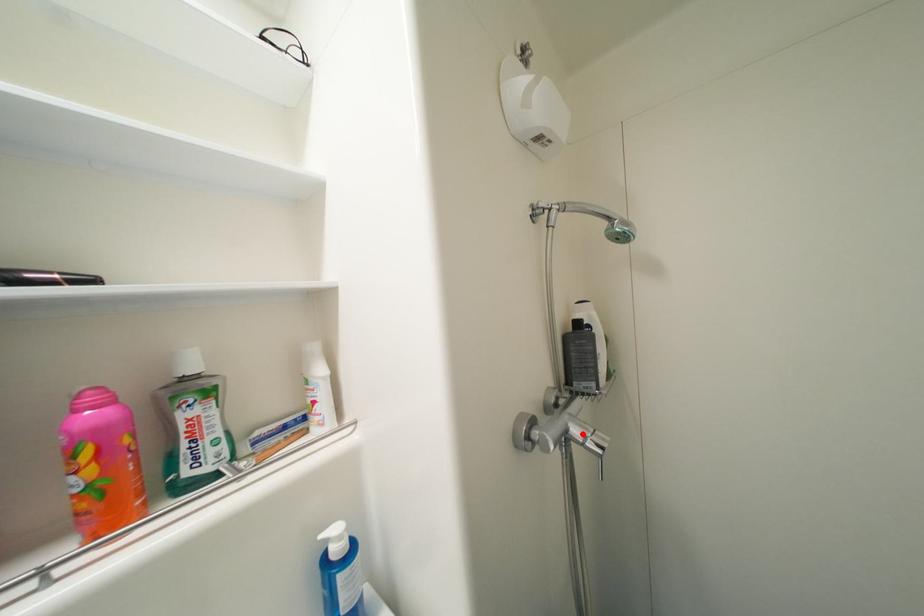
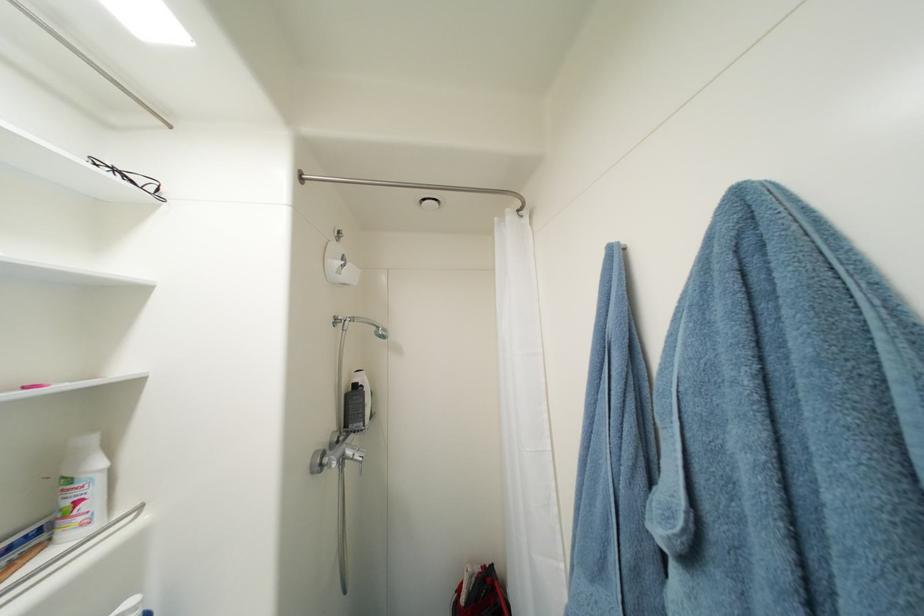
Find the pixel in the second image that matches the highlighted location in the first image.

(356, 454)